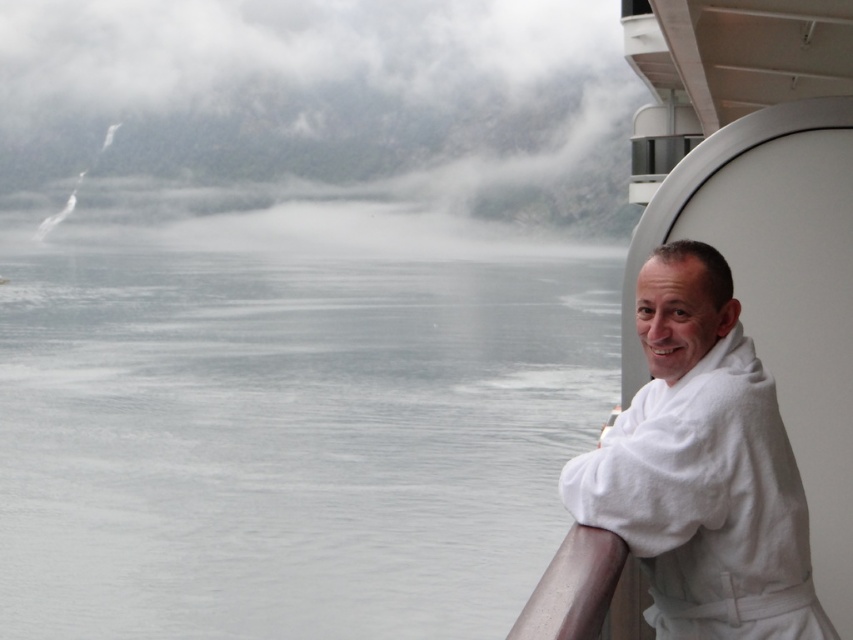
Can you confirm if white bathrobe at right is taller than satin silver railing at lower right?

Correct, white bathrobe at right is much taller as satin silver railing at lower right.

Does point (744, 596) come behind point (593, 556)?

Yes, it is behind point (593, 556).

Measure the distance between point (x=691, y=410) and camera.

Point (x=691, y=410) and camera are 5.97 meters apart.

Find the location of `white bathrobe at right`. white bathrobe at right is located at coordinates (701, 467).

Can you confirm if gray water at left is thinner than white bathrobe at right?

In fact, gray water at left might be wider than white bathrobe at right.

Which is in front, point (299, 438) or point (706, 364)?

Point (706, 364) is in front.

Locate an element on the screen. The height and width of the screenshot is (640, 853). gray water at left is located at coordinates (289, 429).

Who is higher up, white misty fog at upper left or satin silver railing at lower right?

Positioned higher is white misty fog at upper left.

How distant is white misty fog at upper left from satin silver railing at lower right?

A distance of 197.52 feet exists between white misty fog at upper left and satin silver railing at lower right.

What do you see at coordinates (320, 109) in the screenshot?
I see `white misty fog at upper left` at bounding box center [320, 109].

Locate an element on the screen. Image resolution: width=853 pixels, height=640 pixels. white misty fog at upper left is located at coordinates 320,109.